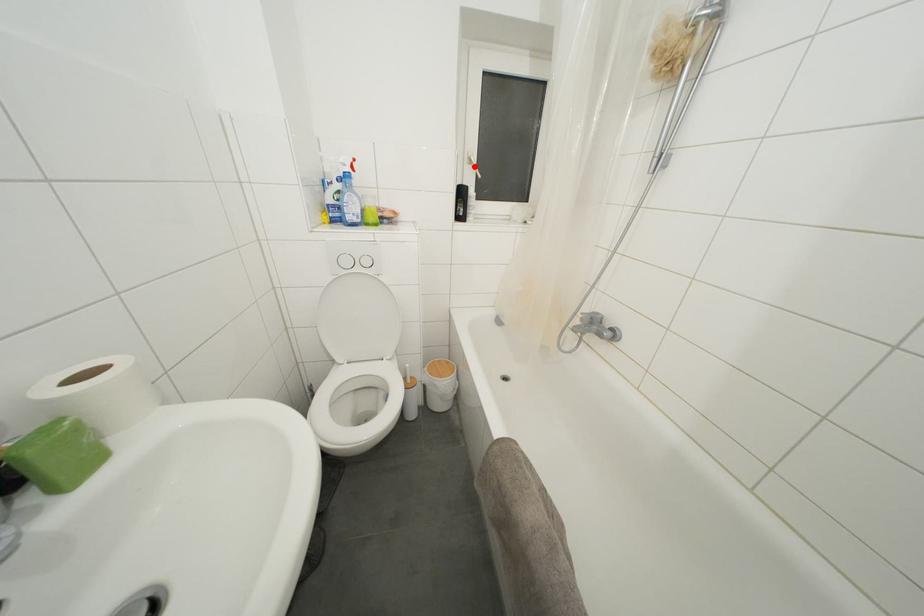
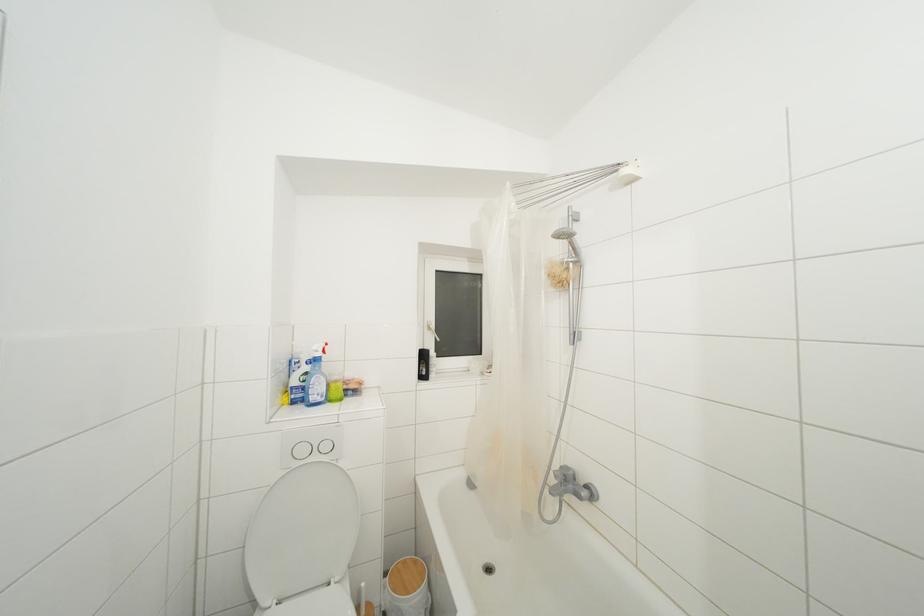
Question: I am providing you with two images of the same scene from different viewpoints. In image1, a red point is highlighted. Considering the same 3D point in image2, which of the following is correct?

Choices:
 (A) It is closer
 (B) It is farther

Answer: (B)